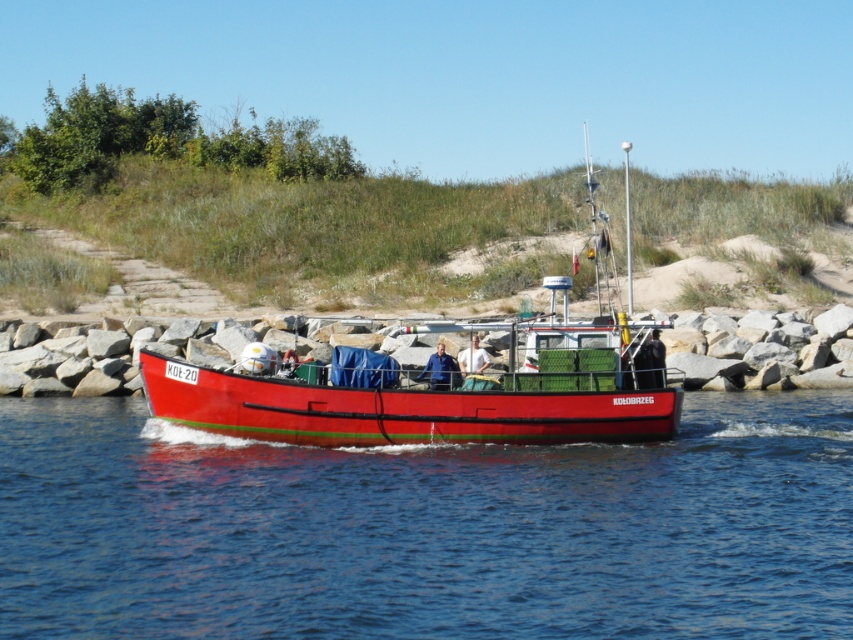
Question: Which object is the farthest from the blue fabric jacket at center?

Choices:
 (A) dark blue fabric jacket at center
 (B) white fabric shirt at center
 (C) shiny red boat at center
 (D) glossy water at boat center

Answer: (D)

Question: Is dark blue fabric jacket at center behind white fabric shirt at center?

Choices:
 (A) yes
 (B) no

Answer: (B)

Question: Observing the image, what is the correct spatial positioning of glossy water at boat center in reference to white fabric shirt at center?

Choices:
 (A) left
 (B) right

Answer: (A)

Question: Does blue fabric jacket at center have a greater width compared to white fabric shirt at center?

Choices:
 (A) yes
 (B) no

Answer: (A)

Question: Which of the following is the closest to the observer?

Choices:
 (A) dark blue fabric jacket at center
 (B) blue fabric jacket at center
 (C) glossy water at boat center
 (D) shiny red boat at center

Answer: (C)

Question: Which point is farther to the camera?

Choices:
 (A) (467, 372)
 (B) (637, 372)
 (C) (422, 372)

Answer: (C)